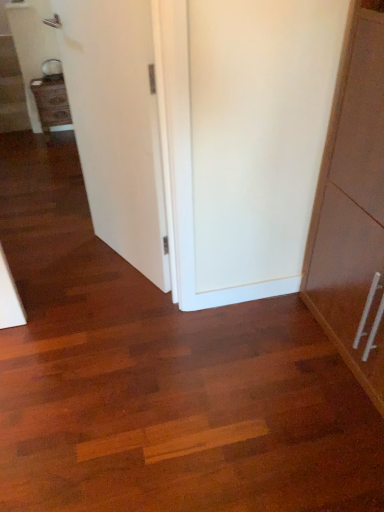
Question: Does matte wood cabinet at left appear on the left side of wooden staircase at left?

Choices:
 (A) no
 (B) yes

Answer: (A)

Question: Is matte wood cabinet at left beside wooden staircase at left?

Choices:
 (A) yes
 (B) no

Answer: (B)

Question: Does matte wood cabinet at left have a lesser height compared to wooden staircase at left?

Choices:
 (A) yes
 (B) no

Answer: (B)

Question: Considering the relative sizes of matte wood cabinet at left and wooden staircase at left in the image provided, is matte wood cabinet at left bigger than wooden staircase at left?

Choices:
 (A) no
 (B) yes

Answer: (A)

Question: From a real-world perspective, is matte wood cabinet at left physically above wooden staircase at left?

Choices:
 (A) yes
 (B) no

Answer: (A)

Question: From a real-world perspective, is matte wood cabinet at left located beneath wooden staircase at left?

Choices:
 (A) no
 (B) yes

Answer: (A)

Question: From the image's perspective, does wooden staircase at left appear higher than white smooth door at center?

Choices:
 (A) yes
 (B) no

Answer: (A)

Question: Is wooden staircase at left further to camera compared to white smooth door at center?

Choices:
 (A) yes
 (B) no

Answer: (A)

Question: Does wooden staircase at left have a lesser height compared to white smooth door at center?

Choices:
 (A) no
 (B) yes

Answer: (B)

Question: From the image's perspective, is wooden staircase at left located beneath white smooth door at center?

Choices:
 (A) no
 (B) yes

Answer: (A)

Question: Are wooden staircase at left and white smooth door at center located far from each other?

Choices:
 (A) yes
 (B) no

Answer: (A)

Question: Is white smooth door at center a part of wooden staircase at left?

Choices:
 (A) no
 (B) yes

Answer: (A)

Question: Is wooden staircase at left next to matte wood cabinet at left and touching it?

Choices:
 (A) no
 (B) yes

Answer: (A)